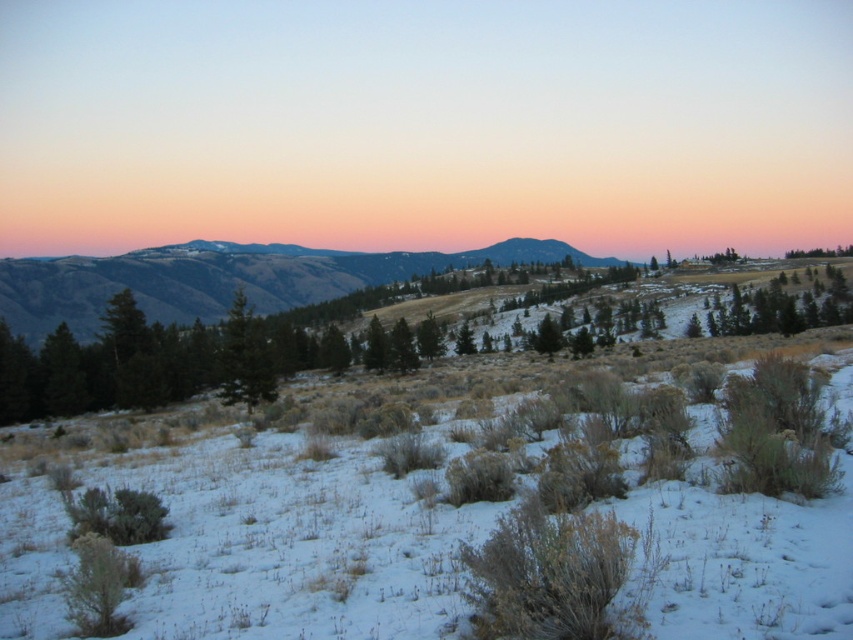
Question: Which point is farther to the camera?

Choices:
 (A) (273, 388)
 (B) (277, 284)

Answer: (B)

Question: Is green matte tree at right below green matte tree at center?

Choices:
 (A) yes
 (B) no

Answer: (B)

Question: Which of the following is the closest to the observer?

Choices:
 (A) green matte tree at center
 (B) green grassy hillside at center

Answer: (A)

Question: Which point is closer to the camera?

Choices:
 (A) green matte tree at right
 (B) green matte tree at center

Answer: (B)

Question: Is green matte tree at right in front of green matte tree at center?

Choices:
 (A) yes
 (B) no

Answer: (B)

Question: Is green grassy hillside at center further to the viewer compared to green matte tree at center?

Choices:
 (A) yes
 (B) no

Answer: (A)